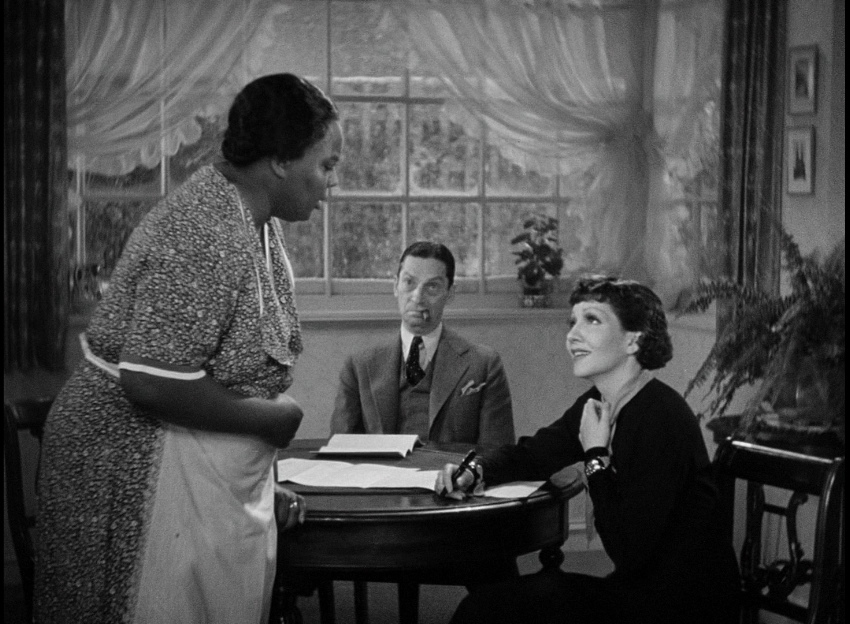
You are a GUI agent. You are given a task and a screenshot of the screen. Output one action in this format:
    pyautogui.click(x=<x>, y=<y>)
    Task: Click on the chair
    The height and width of the screenshot is (624, 850).
    Given the screenshot: What is the action you would take?
    pyautogui.click(x=751, y=495), pyautogui.click(x=14, y=409)